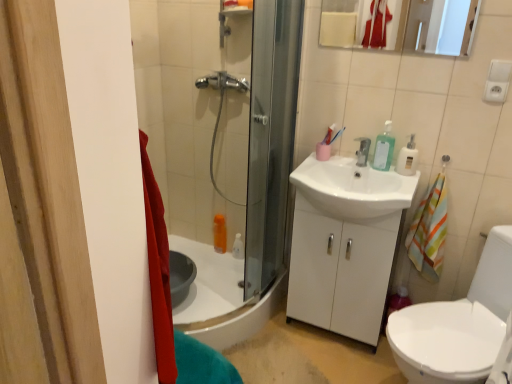
Find the location of a particular element. This screenshot has height=384, width=512. silver metallic faucet at center is located at coordinates (362, 151).

The height and width of the screenshot is (384, 512). I want to click on matte white mirror at upper center, so click(400, 25).

From the image's perspective, which object appears higher, clear plastic soap dispenser at upper right or silver metallic faucet at center?

silver metallic faucet at center appears higher in the image.

Is clear plastic soap dispenser at upper right next to silver metallic faucet at center and touching it?

clear plastic soap dispenser at upper right and silver metallic faucet at center are clearly separated.

Would you say clear plastic soap dispenser at upper right contains silver metallic faucet at center?

No, silver metallic faucet at center is not a part of clear plastic soap dispenser at upper right.

Does point (401, 171) lie behind point (362, 161)?

No, (401, 171) is closer to viewer.

Is white glossy sink at center oriented towards matte white mirror at upper center?

No, white glossy sink at center is not aimed at matte white mirror at upper center.

Does white glossy sink at center have a lesser height compared to matte white mirror at upper center?

No, white glossy sink at center is not shorter than matte white mirror at upper center.

Would you consider white glossy sink at center to be distant from matte white mirror at upper center?

They are positioned close to each other.

From a real-world perspective, who is located higher, white glossy sink at center or matte white mirror at upper center?

matte white mirror at upper center is physically above.

Is point (392, 188) positioned behind point (358, 155)?

No, (392, 188) is closer to viewer.

Is white glossy sink at center oriented away from silver metallic faucet at center?

No, white glossy sink at center's orientation is not away from silver metallic faucet at center.

Is white glossy sink at center inside or outside of silver metallic faucet at center?

white glossy sink at center cannot be found inside silver metallic faucet at center.

Identify the location of tap above the white glossy sink at center (from the image's perspective). This screenshot has width=512, height=384. (362, 151).

Could you tell me if translucent plastic soap dispenser at upper right is turned towards white glossy sink at center?

No, translucent plastic soap dispenser at upper right is not facing towards white glossy sink at center.

From a real-world perspective, is translucent plastic soap dispenser at upper right located beneath white glossy sink at center?

No, from a real-world perspective, translucent plastic soap dispenser at upper right is not under white glossy sink at center.

Locate an element on the screen. The image size is (512, 384). toiletry above the white glossy sink at center (from the image's perspective) is located at coordinates (384, 148).

Identify the location of tap directly beneath the matte white mirror at upper center (from a real-world perspective). This screenshot has width=512, height=384. (362, 151).

Is matte white mirror at upper center turned away from silver metallic faucet at center?

matte white mirror at upper center does not have its back to silver metallic faucet at center.

Which of these two, matte white mirror at upper center or silver metallic faucet at center, stands shorter?

silver metallic faucet at center is shorter.

Where is `mirror above the translucent plastic soap dispenser at upper right (from a real-world perspective)`? The height and width of the screenshot is (384, 512). mirror above the translucent plastic soap dispenser at upper right (from a real-world perspective) is located at coordinates (400, 25).

In terms of width, does matte white mirror at upper center look wider or thinner when compared to translucent plastic soap dispenser at upper right?

Considering their sizes, matte white mirror at upper center looks slimmer than translucent plastic soap dispenser at upper right.

Would you say matte white mirror at upper center contains translucent plastic soap dispenser at upper right?

No, translucent plastic soap dispenser at upper right is not a part of matte white mirror at upper center.

Between matte white mirror at upper center and white glossy sink at center, which one has more height?

With more height is white glossy sink at center.

Is matte white mirror at upper center in front of or behind white glossy sink at center in the image?

Visually, matte white mirror at upper center is located behind white glossy sink at center.

Based on the photo, is matte white mirror at upper center positioned beyond the bounds of white glossy sink at center?

Yes, matte white mirror at upper center is outside of white glossy sink at center.

Is point (468, 0) positioned before point (395, 203)?

That is True.

Locate an element on the screen. The height and width of the screenshot is (384, 512). tap directly beneath the clear plastic soap dispenser at upper right (from a real-world perspective) is located at coordinates (362, 151).

The height and width of the screenshot is (384, 512). I want to click on sink in front of the matte white mirror at upper center, so click(x=353, y=188).

Looking at the image, which one is located closer to silver metallic faucet at center, matte white mirror at upper center or white glossy sink at center?

A: white glossy sink at center lies closer to silver metallic faucet at center than the other object.

When comparing their distances from translucent plastic soap dispenser at upper right, does clear plastic soap dispenser at upper right or silver metallic faucet at center seem further?

Among the two, silver metallic faucet at center is located further to translucent plastic soap dispenser at upper right.

From the image, which object appears to be farther from clear plastic soap dispenser at upper right, white glossy sink at center or translucent plastic soap dispenser at upper right?

Based on the image, white glossy sink at center appears to be further to clear plastic soap dispenser at upper right.

From the image, which object appears to be nearer to silver metallic faucet at center, clear plastic soap dispenser at upper right or matte white mirror at upper center?

clear plastic soap dispenser at upper right lies closer to silver metallic faucet at center than the other object.

In the scene shown: Based on their spatial positions, is matte white mirror at upper center or translucent plastic soap dispenser at upper right closer to clear plastic soap dispenser at upper right?

translucent plastic soap dispenser at upper right lies closer to clear plastic soap dispenser at upper right than the other object.

Based on their spatial positions, is translucent plastic soap dispenser at upper right or white glossy sink at center closer to clear plastic soap dispenser at upper right?

Among the two, translucent plastic soap dispenser at upper right is located nearer to clear plastic soap dispenser at upper right.

Looking at the image, which one is located further to translucent plastic soap dispenser at upper right, matte white mirror at upper center or silver metallic faucet at center?

matte white mirror at upper center lies further to translucent plastic soap dispenser at upper right than the other object.

Looking at the image, which one is located closer to white glossy sink at center, matte white mirror at upper center or silver metallic faucet at center?

Among the two, silver metallic faucet at center is located nearer to white glossy sink at center.

Find the location of a particular element. toiletry between matte white mirror at upper center and clear plastic soap dispenser at upper right in the vertical direction is located at coordinates (384, 148).

This screenshot has width=512, height=384. I want to click on tap between white glossy sink at center and clear plastic soap dispenser at upper right from left to right, so click(362, 151).

This screenshot has width=512, height=384. What are the coordinates of `toiletry between matte white mirror at upper center and silver metallic faucet at center in the vertical direction` in the screenshot? It's located at (384, 148).

This screenshot has height=384, width=512. Find the location of `soap dispenser between translucent plastic soap dispenser at upper right and white glossy sink at center vertically`. soap dispenser between translucent plastic soap dispenser at upper right and white glossy sink at center vertically is located at coordinates (407, 158).